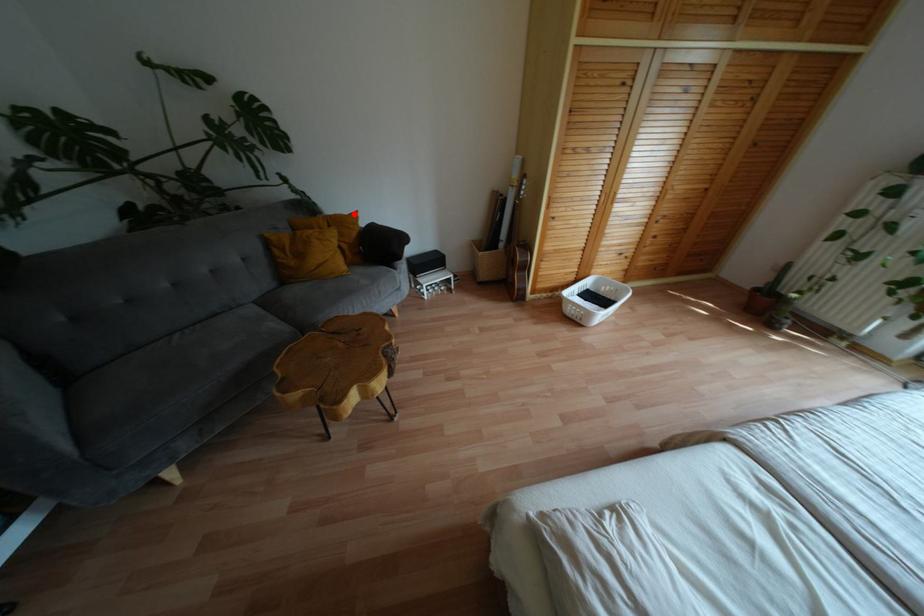
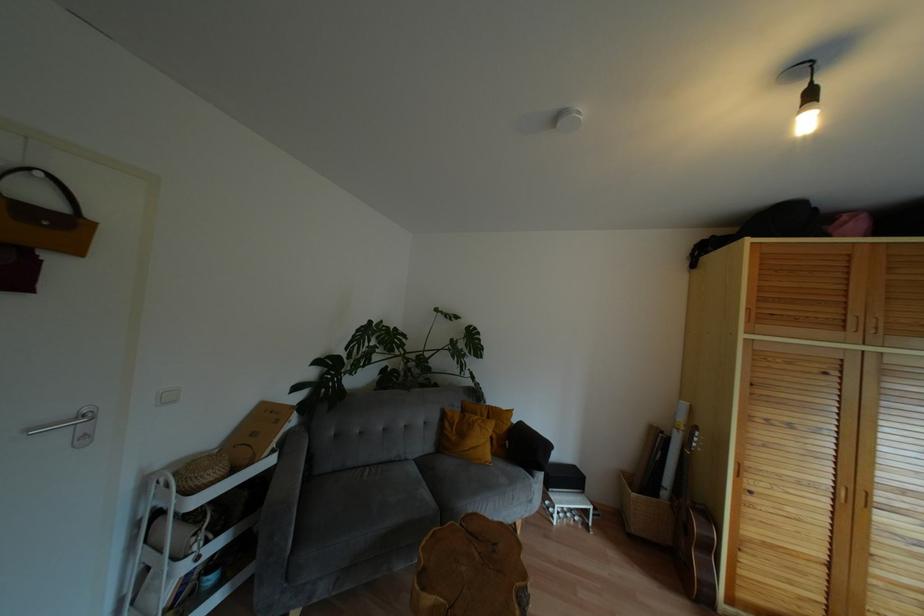
The point at the highlighted location is marked in the first image. Where is the corresponding point in the second image?

(508, 411)